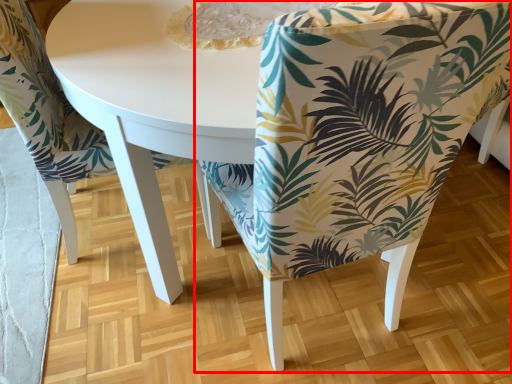
Question: From the image's perspective, where is chair (annotated by the red box) located relative to chair?

Choices:
 (A) above
 (B) below

Answer: (B)